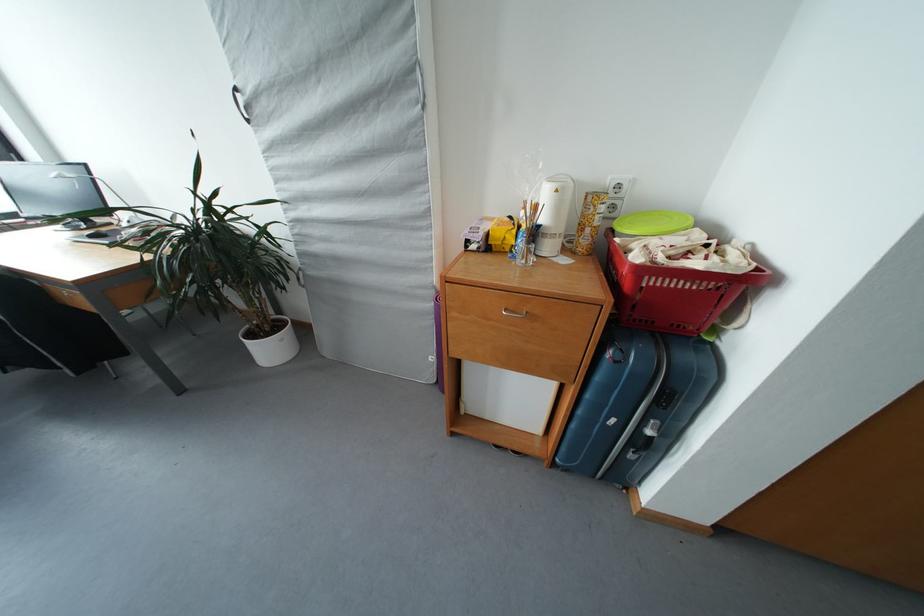
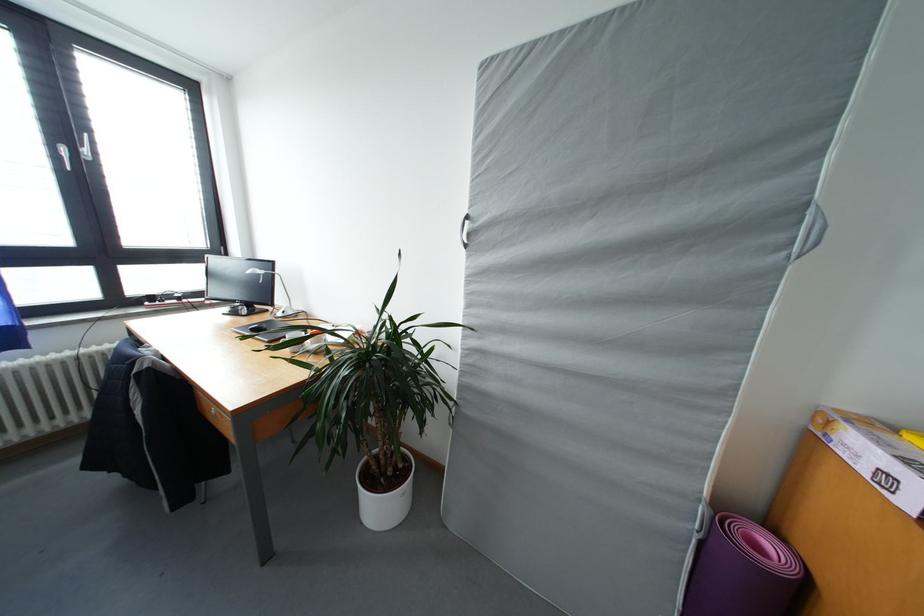
Question: How did the camera likely rotate?

Choices:
 (A) Left
 (B) Right
 (C) Up
 (D) Down

Answer: (C)